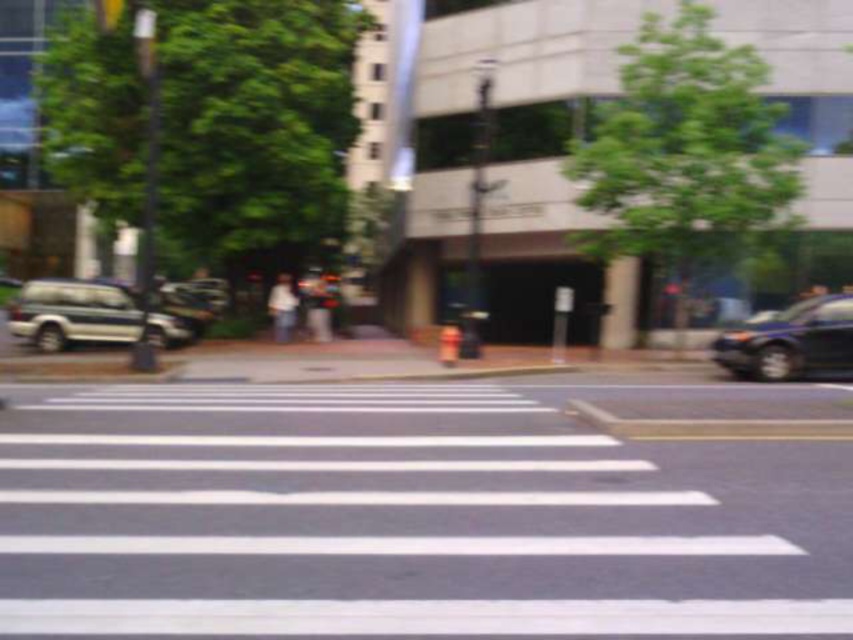
You are a delivery person needing to park your van between the metallic silver suv at left and the shiny blue sedan at right. Can your van, which is 20 feet long, fit in the available space between them?

The metallic silver suv at left is 38.55 feet from the shiny blue sedan at right. Since your van is 20 feet long, there is enough space between them to park your van.

You are a delivery person trying to park your van between the metallic silver suv at left and the shiny blue sedan at right. Considering their sizes, will there be enough space for your van?

The metallic silver suv at left is bigger than the shiny blue sedan at right, so there might not be enough space between them for your van.